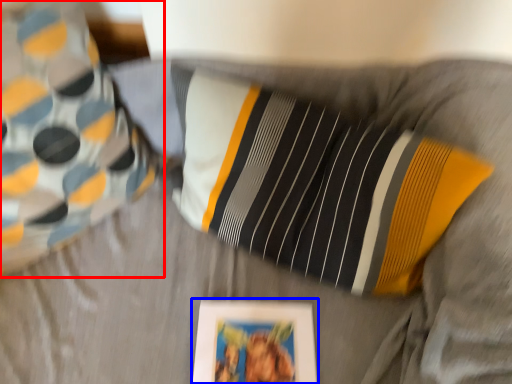
Question: Which object appears farthest to the camera in this image, pillow (highlighted by a red box) or picture frame (highlighted by a blue box)?

Choices:
 (A) pillow
 (B) picture frame

Answer: (B)